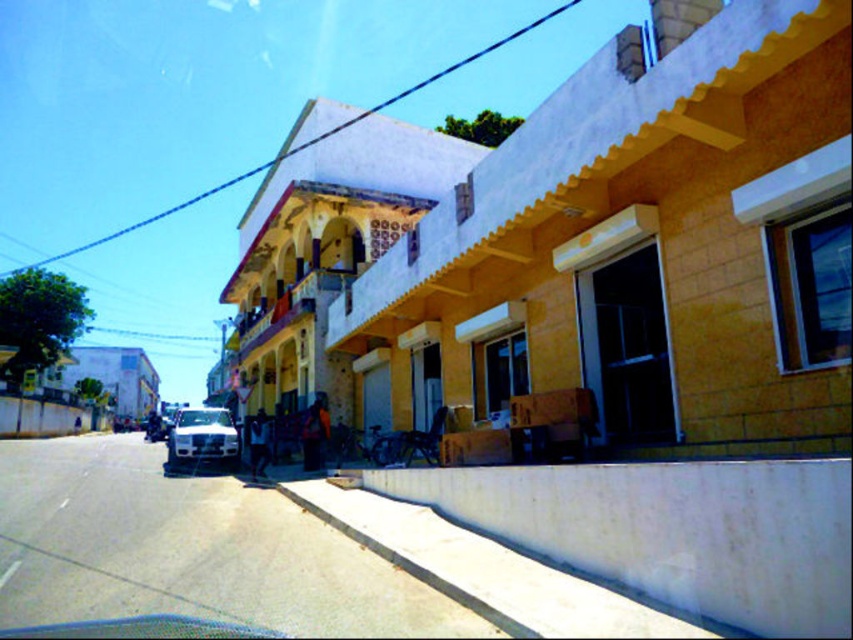
Is point (231, 420) positioned after point (161, 424)?

No, it is not.

Which is behind, point (212, 419) or point (166, 420)?

The point (166, 420) is more distant.

The height and width of the screenshot is (640, 853). Identify the location of white glossy car at center. (202, 435).

Between white concrete curb at lower center and white glossy car at center, which one appears on the left side from the viewer's perspective?

white glossy car at center

The width and height of the screenshot is (853, 640). In order to click on white concrete curb at lower center in this screenshot , I will do `click(671, 531)`.

Who is taller, white concrete curb at lower center or shiny silver motorcycle at center?

With more height is shiny silver motorcycle at center.

Is white concrete curb at lower center to the right of shiny silver motorcycle at center from the viewer's perspective?

Yes, white concrete curb at lower center is to the right of shiny silver motorcycle at center.

You are a GUI agent. You are given a task and a screenshot of the screen. Output one action in this format:
    pyautogui.click(x=<x>, y=<y>)
    Task: Click on the white concrete curb at lower center
    The image size is (853, 640).
    Given the screenshot: What is the action you would take?
    pyautogui.click(x=671, y=531)